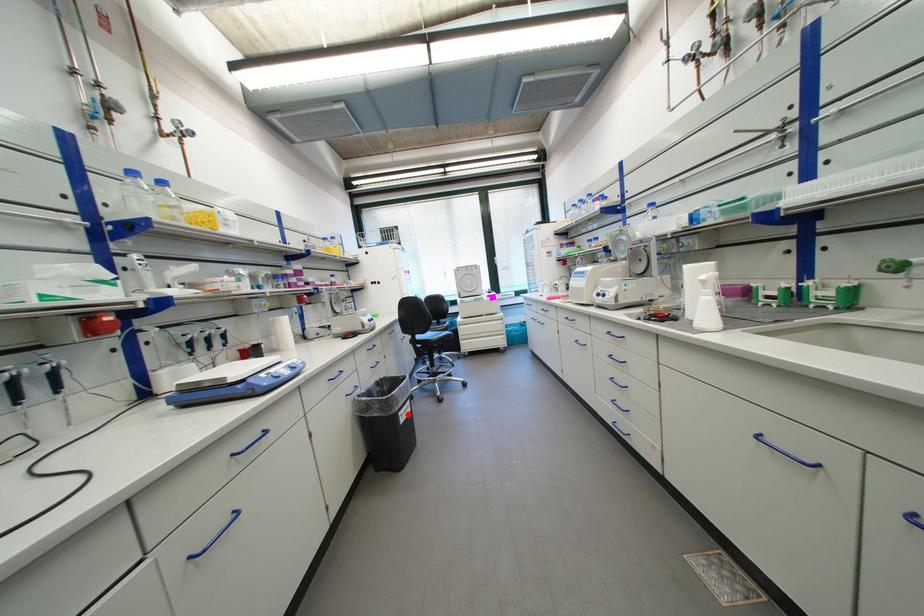
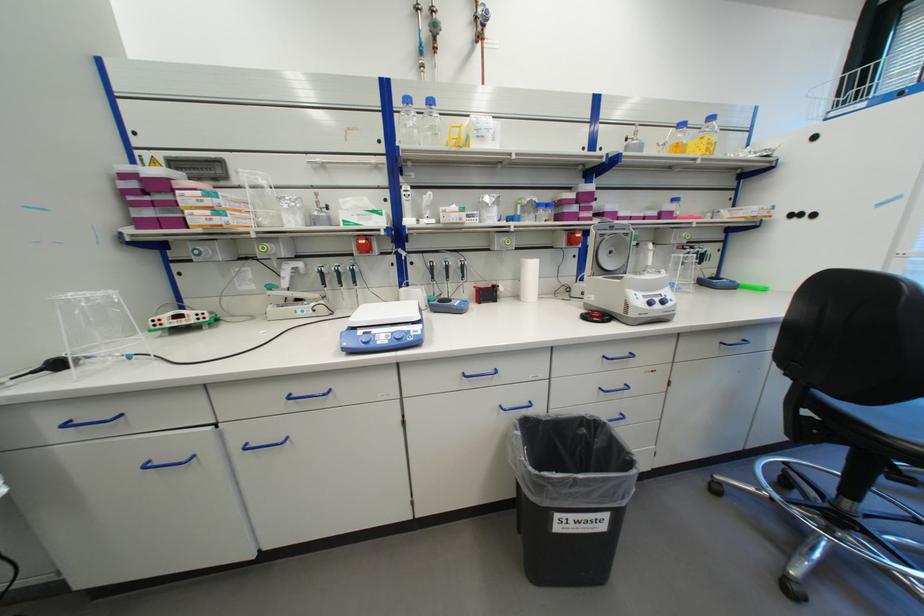
Locate, in the second image, the point that corresponds to the highlighted location in the first image.

(565, 517)